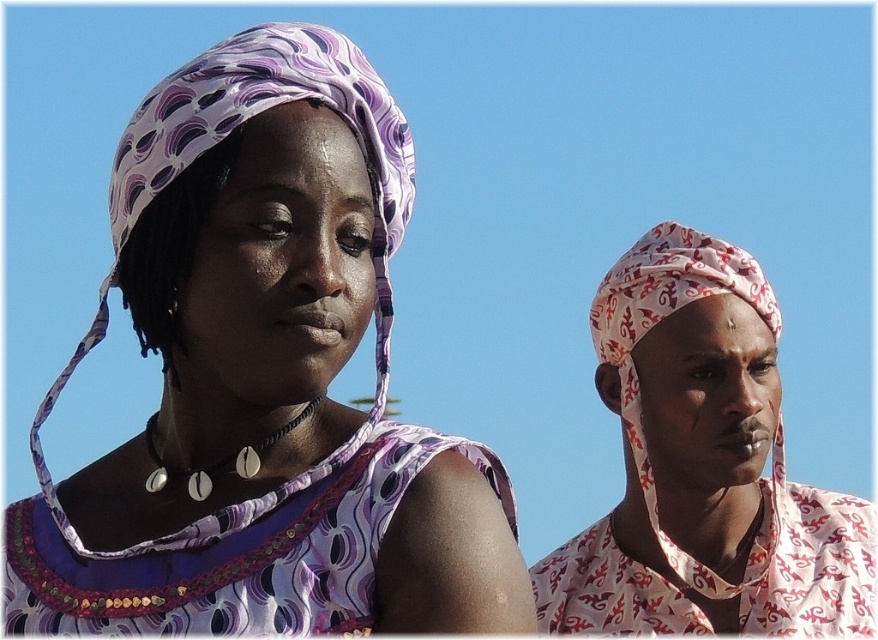
Can you confirm if printed fabric headscarf at right is positioned above purple fabric dress at left?

Yes.

Which is more to the right, printed fabric headscarf at right or purple fabric dress at left?

printed fabric headscarf at right

Is point (710, 547) positioned behind point (283, 506)?

Yes, point (710, 547) is behind point (283, 506).

Find the location of a particular element. The image size is (878, 640). printed fabric headscarf at right is located at coordinates (704, 467).

Does purple printed headscarf at upper left come in front of printed fabric headscarf at right?

Yes.

Consider the image. Can you confirm if purple printed headscarf at upper left is bigger than printed fabric headscarf at right?

Incorrect, purple printed headscarf at upper left is not larger than printed fabric headscarf at right.

What do you see at coordinates (264, 381) in the screenshot? I see `purple printed headscarf at upper left` at bounding box center [264, 381].

What are the coordinates of `purple printed headscarf at upper left` in the screenshot? It's located at (264, 381).

In the scene shown: Can you confirm if purple printed headscarf at upper left is positioned to the right of purple fabric dress at left?

In fact, purple printed headscarf at upper left is to the left of purple fabric dress at left.

Based on the photo, which of these two, purple printed headscarf at upper left or purple fabric dress at left, stands shorter?

purple fabric dress at left

The image size is (878, 640). What do you see at coordinates (264, 381) in the screenshot?
I see `purple printed headscarf at upper left` at bounding box center [264, 381].

Find the location of a particular element. This screenshot has width=878, height=640. purple printed headscarf at upper left is located at coordinates (264, 381).